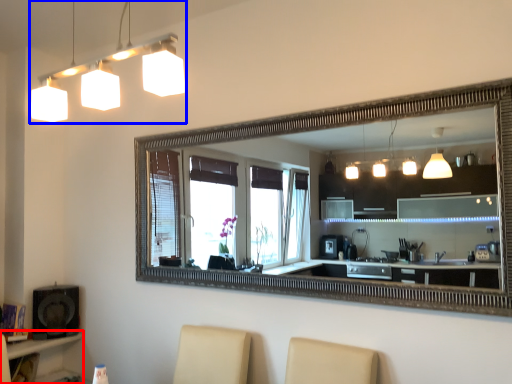
Question: Which object appears closest to the camera in this image, vanity (highlighted by a red box) or lamp (highlighted by a blue box)?

Choices:
 (A) vanity
 (B) lamp

Answer: (B)